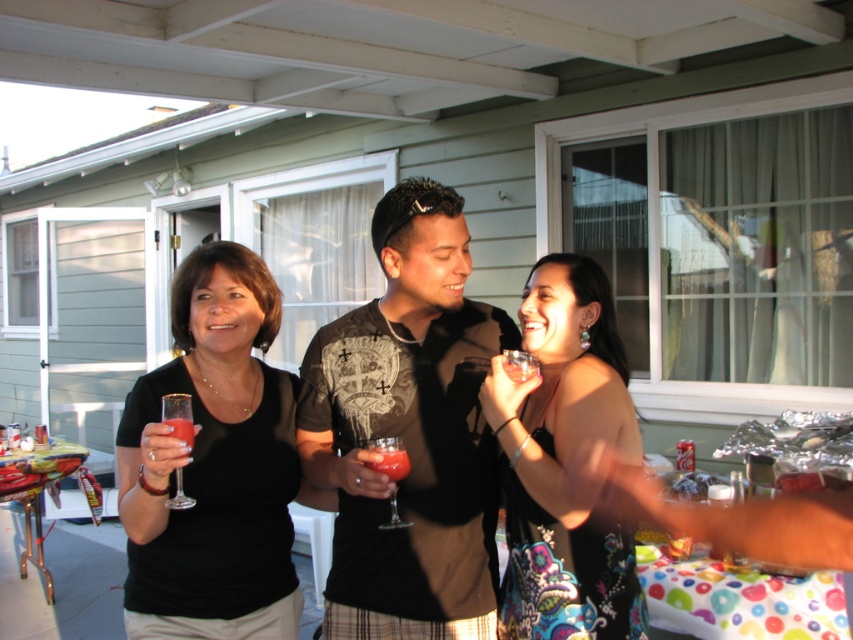
You are a server at the party and need to place a new wine glass between the two existing ones. The new glass has a diameter of 4 inches. Can you fit it between the translucent glass wine glass at lower left and the translucent glass wine glass at center without moving the existing glasses?

→ The distance between the translucent glass wine glass at lower left and the translucent glass wine glass at center is 15.58 inches. Since the new glass has a diameter of 4 inches, there is enough space to fit it between them as 15.58 inches is greater than 4 inches.

You are a guest at the party and want to place your black matte dress at center on the table next to the translucent glass wine glass at lower left. However, you notice the table has limited space. Based on their sizes, which object will require more space on the table?

The black matte dress at center requires more space on the table because it is larger in size compared to the translucent glass wine glass at lower left.

Based on the photo, you are a photographer at the event and want to capture a photo of the black matte dress at center and the translucent glass wine glass at lower left. Which object should you focus on first if you want to ensure both are in focus?

The black matte dress at center is taller than the translucent glass wine glass at lower left, so focusing on the black matte dress at center first would help ensure both are in focus as it is the larger object in the frame.